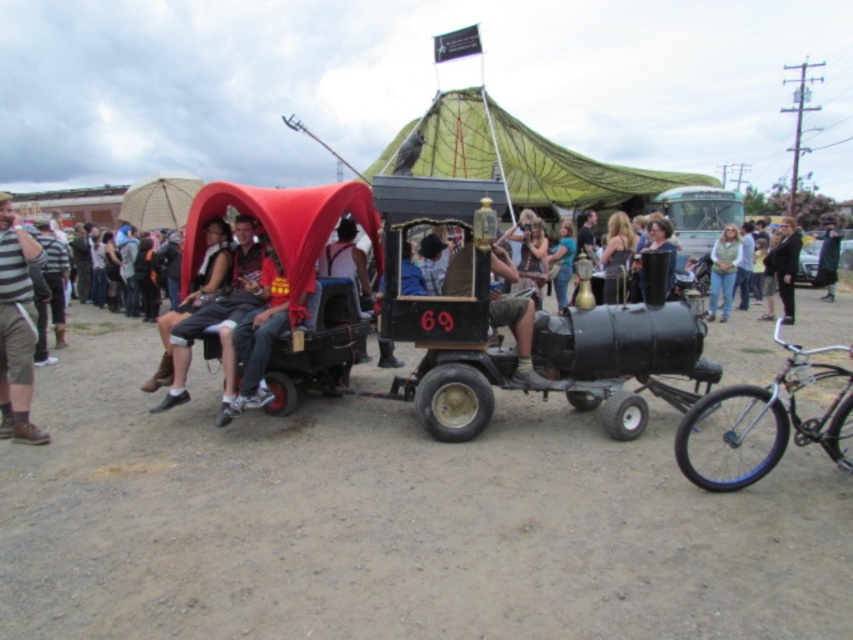
Is the position of matte black shorts at center more distant than that of denim jacket at center?

No, matte black shorts at center is closer to the viewer.

Does matte black shorts at center have a greater width compared to denim jacket at center?

No, matte black shorts at center is not wider than denim jacket at center.

Between point (189, 296) and point (738, 244), which one is positioned behind?

The point (738, 244) is behind.

You are a GUI agent. You are given a task and a screenshot of the screen. Output one action in this format:
    pyautogui.click(x=<x>, y=<y>)
    Task: Click on the matte black shorts at center
    The image size is (853, 640).
    Given the screenshot: What is the action you would take?
    pyautogui.click(x=210, y=310)

Which of these two, black matte steam engine at center or dark gray suit at center, stands taller?

black matte steam engine at center

From the picture: Can you confirm if black matte steam engine at center is positioned to the right of dark gray suit at center?

In fact, black matte steam engine at center is to the left of dark gray suit at center.

Which is in front, point (543, 372) or point (786, 300)?

Positioned in front is point (543, 372).

Where is `black matte steam engine at center`? black matte steam engine at center is located at coordinates (532, 330).

Is black matte steam engine at center to the right of shiny silver bicycle at lower right from the viewer's perspective?

No, black matte steam engine at center is not to the right of shiny silver bicycle at lower right.

Can you confirm if black matte steam engine at center is thinner than shiny silver bicycle at lower right?

No.

Between point (532, 387) and point (836, 461), which one is positioned behind?

The point (532, 387) is behind.

Find the location of `black matte steam engine at center`. black matte steam engine at center is located at coordinates (532, 330).